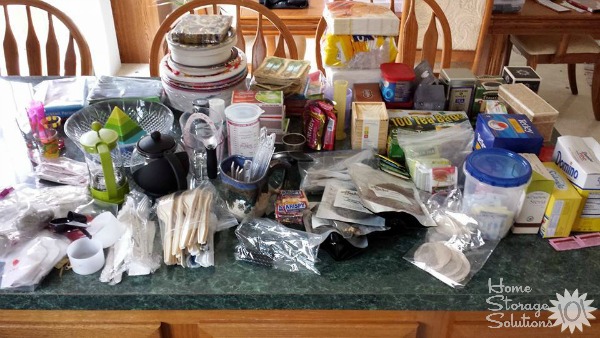
Find the location of a particular element. The width and height of the screenshot is (600, 338). chair is located at coordinates click(434, 53).